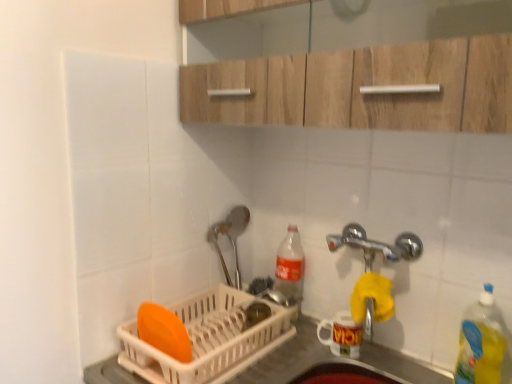
Question: Considering the relative sizes of white plastic dish rack at lower left and translucent plastic bottle at center, the second bottle from the front, in the image provided, is white plastic dish rack at lower left smaller than translucent plastic bottle at center, the second bottle from the front,?

Choices:
 (A) yes
 (B) no

Answer: (B)

Question: Can you confirm if white plastic dish rack at lower left is positioned to the left of translucent plastic bottle at center, the 1th bottle viewed from the left?

Choices:
 (A) yes
 (B) no

Answer: (A)

Question: Would you say white plastic dish rack at lower left contains translucent plastic bottle at center, the second bottle from the front?

Choices:
 (A) no
 (B) yes

Answer: (A)

Question: Can you confirm if white plastic dish rack at lower left is thinner than translucent plastic bottle at center, the second bottle from the front?

Choices:
 (A) yes
 (B) no

Answer: (B)

Question: Can you confirm if white plastic dish rack at lower left is shorter than translucent plastic bottle at center, placed as the second bottle when sorted from right to left?

Choices:
 (A) no
 (B) yes

Answer: (B)

Question: Considering the relative sizes of white plastic dish rack at lower left and translucent plastic bottle at center, the second bottle from the front, in the image provided, is white plastic dish rack at lower left bigger than translucent plastic bottle at center, the second bottle from the front,?

Choices:
 (A) no
 (B) yes

Answer: (B)

Question: Is wooden cabinet at upper center in front of yellow translucent bottle at right, placed as the 2th bottle when sorted from back to front?

Choices:
 (A) yes
 (B) no

Answer: (A)

Question: Could you tell me if wooden cabinet at upper center is turned towards yellow translucent bottle at right, the first bottle positioned from the right?

Choices:
 (A) no
 (B) yes

Answer: (A)

Question: Considering the relative sizes of wooden cabinet at upper center and yellow translucent bottle at right, placed as the 2th bottle when sorted from back to front, in the image provided, is wooden cabinet at upper center taller than yellow translucent bottle at right, placed as the 2th bottle when sorted from back to front,?

Choices:
 (A) yes
 (B) no

Answer: (A)

Question: Can you confirm if wooden cabinet at upper center is thinner than yellow translucent bottle at right, which ranks as the first bottle in front-to-back order?

Choices:
 (A) yes
 (B) no

Answer: (B)

Question: Considering the relative positions of wooden cabinet at upper center and yellow translucent bottle at right, the 2th bottle positioned from the left, in the image provided, is wooden cabinet at upper center behind yellow translucent bottle at right, the 2th bottle positioned from the left,?

Choices:
 (A) no
 (B) yes

Answer: (A)

Question: Does wooden cabinet at upper center contain yellow translucent bottle at right, which ranks as the first bottle in front-to-back order?

Choices:
 (A) no
 (B) yes

Answer: (A)